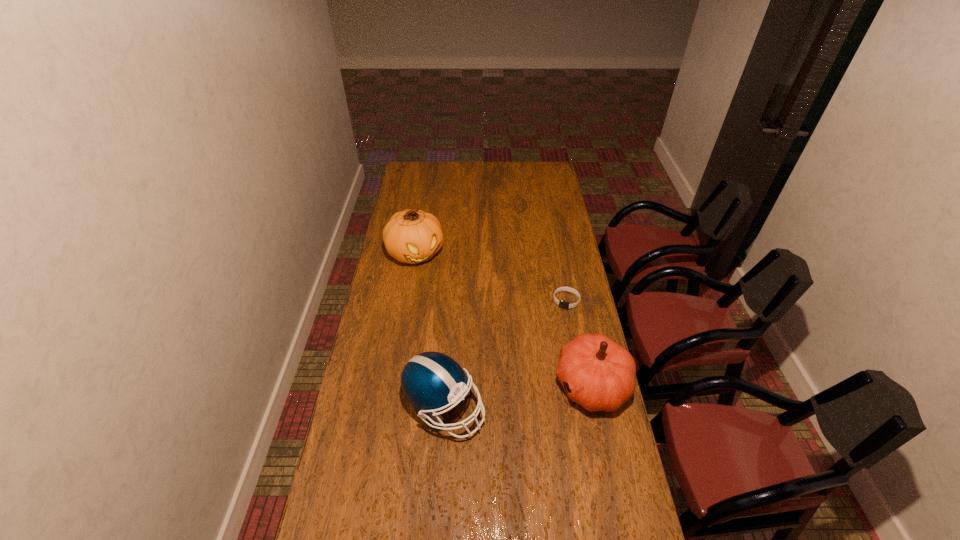
Identify the location of free spot between the nearer pumpkin and the football helmet. (518, 396).

At what (x,y) coordinates should I click in order to perform the action: click on object that is the closest to the shortest object. Please return your answer as a coordinate pair (x, y). This screenshot has width=960, height=540. Looking at the image, I should click on (599, 374).

Find the location of a particular element. The width and height of the screenshot is (960, 540). object that is the second closest to the right pumpkin is located at coordinates (432, 381).

Locate an element on the screen. This screenshot has height=540, width=960. vacant space that satisfies the following two spatial constraints: 1. on the front side of the left pumpkin; 2. at the front of the football helmet with the faceguard is located at coordinates (391, 407).

The height and width of the screenshot is (540, 960). In order to click on vacant point that satisfies the following two spatial constraints: 1. on the front side of the wristband; 2. on the front-facing side of the nearer pumpkin in this screenshot , I will do `click(583, 384)`.